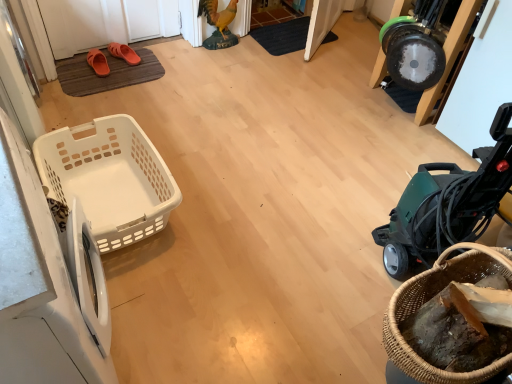
Question: Is orange rubber slipper at upper left, which is the second footwear from right to left, taller than green plastic vacuum cleaner at right?

Choices:
 (A) no
 (B) yes

Answer: (A)

Question: Is orange rubber slipper at upper left, placed as the 1th footwear when sorted from left to right, to the left of green plastic vacuum cleaner at right from the viewer's perspective?

Choices:
 (A) no
 (B) yes

Answer: (B)

Question: Does orange rubber slipper at upper left, placed as the 1th footwear when sorted from left to right, have a greater width compared to green plastic vacuum cleaner at right?

Choices:
 (A) yes
 (B) no

Answer: (B)

Question: From a real-world perspective, is orange rubber slipper at upper left, placed as the 1th footwear when sorted from left to right, over green plastic vacuum cleaner at right?

Choices:
 (A) yes
 (B) no

Answer: (B)

Question: Is orange rubber slipper at upper left, placed as the 1th footwear when sorted from left to right, positioned behind green plastic vacuum cleaner at right?

Choices:
 (A) yes
 (B) no

Answer: (A)

Question: In terms of size, does black textured doormat at center, the 2th doormat positioned from the front, appear bigger or smaller than orange rubber sandals at upper left, the first footwear from the right?

Choices:
 (A) small
 (B) big

Answer: (B)

Question: Is black textured doormat at center, marked as the 1th doormat in a back-to-front arrangement, wider or thinner than orange rubber sandals at upper left, acting as the 2th footwear starting from the left?

Choices:
 (A) wide
 (B) thin

Answer: (A)

Question: In the image, is black textured doormat at center, arranged as the second doormat when viewed from the left, positioned in front of or behind orange rubber sandals at upper left, acting as the 2th footwear starting from the left?

Choices:
 (A) front
 (B) behind

Answer: (B)

Question: From a real-world perspective, is black textured doormat at center, arranged as the 2th doormat when ordered from the bottom, above or below orange rubber sandals at upper left, acting as the 2th footwear starting from the left?

Choices:
 (A) above
 (B) below

Answer: (B)

Question: Considering the positions of woven brown basket at lower right, the 1th basket from the right, and white plastic basket at left, the first basket viewed from the back, in the image, is woven brown basket at lower right, the 1th basket from the right, taller or shorter than white plastic basket at left, the first basket viewed from the back,?

Choices:
 (A) tall
 (B) short

Answer: (B)

Question: In the image, is woven brown basket at lower right, which is the first basket from front to back, on the left side or the right side of white plastic basket at left, the 2th basket in the right-to-left sequence?

Choices:
 (A) right
 (B) left

Answer: (A)

Question: Considering the positions of point [x=392, y=314] and point [x=142, y=145], is point [x=392, y=314] closer or farther from the camera than point [x=142, y=145]?

Choices:
 (A) farther
 (B) closer

Answer: (B)

Question: From the image's perspective, is woven brown basket at lower right, which ranks as the 2th basket in back-to-front order, above or below white plastic basket at left, the first basket viewed from the back?

Choices:
 (A) below
 (B) above

Answer: (A)

Question: From a real-world perspective, relative to orange rubber sandals at upper left, the first footwear from the right, is white plastic washing machine at left, which appears as the second washing machine when viewed from the left, vertically above or below?

Choices:
 (A) below
 (B) above

Answer: (B)

Question: In terms of size, does white plastic washing machine at left, which appears as the second washing machine when viewed from the left, appear bigger or smaller than orange rubber sandals at upper left, acting as the 2th footwear starting from the left?

Choices:
 (A) big
 (B) small

Answer: (A)